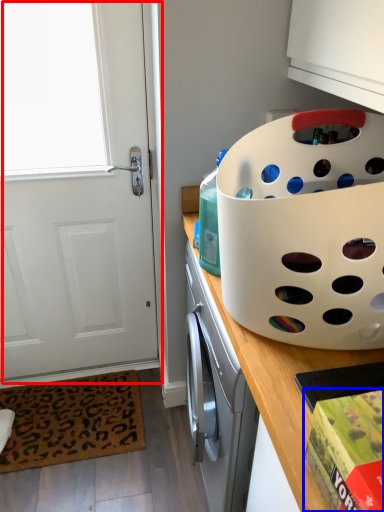
Question: Which point is further to the camera, door (highlighted by a red box) or box (highlighted by a blue box)?

Choices:
 (A) door
 (B) box

Answer: (A)